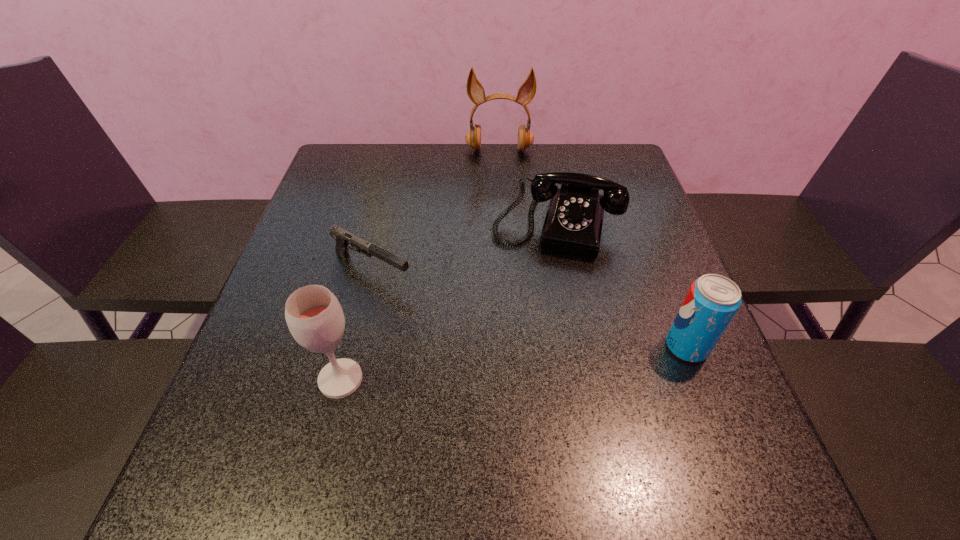
The width and height of the screenshot is (960, 540). I want to click on gun located at the left edge, so click(x=343, y=238).

Locate an element on the screen. soda can at the right edge is located at coordinates (712, 301).

Find the location of a particular element. This screenshot has height=540, width=960. telephone present at the right edge is located at coordinates (573, 224).

You are a GUI agent. You are given a task and a screenshot of the screen. Output one action in this format:
    pyautogui.click(x=<x>, y=<y>)
    Task: Click on the object at the near left corner
    This screenshot has height=540, width=960.
    Given the screenshot: What is the action you would take?
    [314, 316]

Find the location of a particular element. The image size is (960, 540). free space at the far edge of the desktop is located at coordinates (564, 167).

In the image, there is a desktop. Where is `vacant space at the left edge`? vacant space at the left edge is located at coordinates [316, 207].

Locate an element on the screen. This screenshot has height=540, width=960. free location at the right edge is located at coordinates (648, 321).

Where is `blank space at the near left corner`? blank space at the near left corner is located at coordinates (289, 399).

Where is `empty space between the soda can and the shortest object`? The height and width of the screenshot is (540, 960). empty space between the soda can and the shortest object is located at coordinates (529, 308).

Where is `free area in between the soda can and the wineglass`? free area in between the soda can and the wineglass is located at coordinates (514, 363).